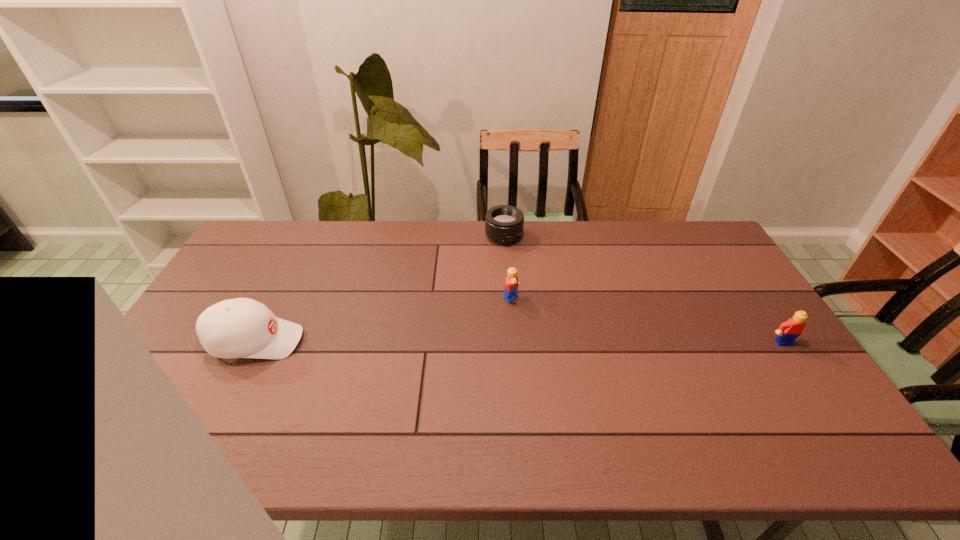
At what (x,y) coordinates should I click in order to perform the action: click on free space located on the face of the farther Lego. Please return your answer as a coordinate pair (x, y). The width and height of the screenshot is (960, 540). Looking at the image, I should click on (574, 342).

You are a GUI agent. You are given a task and a screenshot of the screen. Output one action in this format:
    pyautogui.click(x=<x>, y=<y>)
    Task: Click on the free location located 0.310m on the face of the farther Lego
    
    Given the screenshot: What is the action you would take?
    pyautogui.click(x=604, y=363)

Locate an element on the screen. The image size is (960, 540). vacant space located 0.250m on the side of the telephoto lens with brand markings and control switches is located at coordinates (542, 292).

Find the location of a particular element. This screenshot has height=540, width=960. free space located 0.240m on the side of the telephoto lens with brand markings and control switches is located at coordinates (541, 289).

The width and height of the screenshot is (960, 540). Find the location of `vacant region located 0.060m on the side of the telephoto lens with brand markings and control switches`. vacant region located 0.060m on the side of the telephoto lens with brand markings and control switches is located at coordinates (518, 257).

Identify the location of object that is at the far edge. (504, 224).

Identify the location of object present at the left edge. This screenshot has width=960, height=540. (235, 328).

The width and height of the screenshot is (960, 540). Identify the location of object that is at the right edge. (788, 331).

Identify the location of free space at the far edge. (430, 244).

At what (x,y) coordinates should I click in order to perform the action: click on vacant region at the near edge of the desktop. Please return your answer as a coordinate pair (x, y). Looking at the image, I should click on (683, 413).